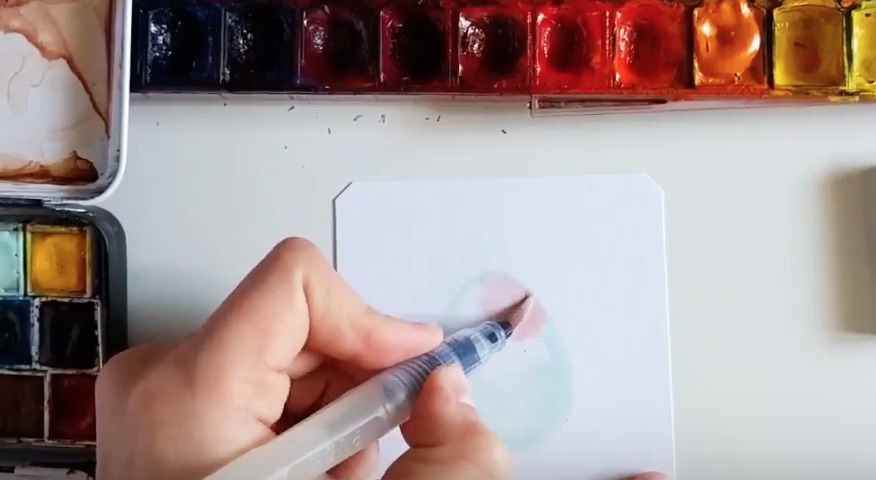
Find the location of a particular element. The image size is (876, 480). orange paint is located at coordinates (735, 46).